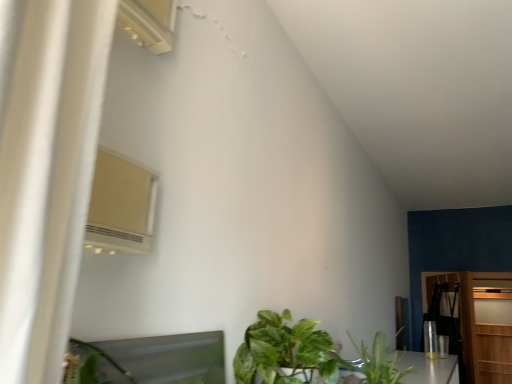
Question: From a real-world perspective, is white plastic air conditioner at upper left positioned above or below green leafy plant at lower center, acting as the second houseplant starting from the right?

Choices:
 (A) above
 (B) below

Answer: (A)

Question: Is white plastic air conditioner at upper left wider or thinner than green leafy plant at lower center, acting as the second houseplant starting from the right?

Choices:
 (A) wide
 (B) thin

Answer: (B)

Question: Which of these objects is positioned closest to the white plastic air conditioner at upper left?

Choices:
 (A) wooden dresser at right
 (B) green leafy plant at lower center, acting as the second houseplant starting from the right
 (C) green leafy plant at lower center, the 2th houseplant in the left-to-right sequence
 (D) wooden door at right

Answer: (B)

Question: Which of these objects is positioned closest to the green leafy plant at lower center, acting as the second houseplant starting from the right?

Choices:
 (A) wooden dresser at right
 (B) wooden door at right
 (C) white plastic air conditioner at upper left
 (D) green leafy plant at lower center, the 2th houseplant in the left-to-right sequence

Answer: (D)